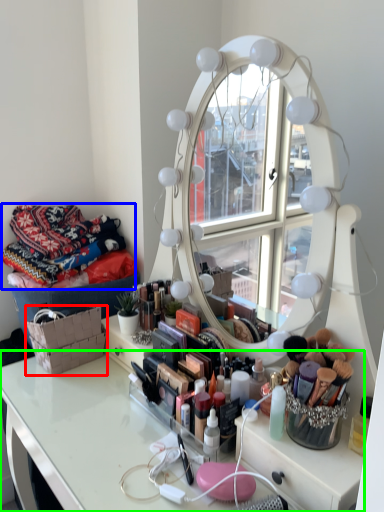
Question: Based on their relative distances, which object is nearer to basket (highlighted by a red box)? Choose from material (highlighted by a blue box) and table (highlighted by a green box).

Choices:
 (A) material
 (B) table

Answer: (B)